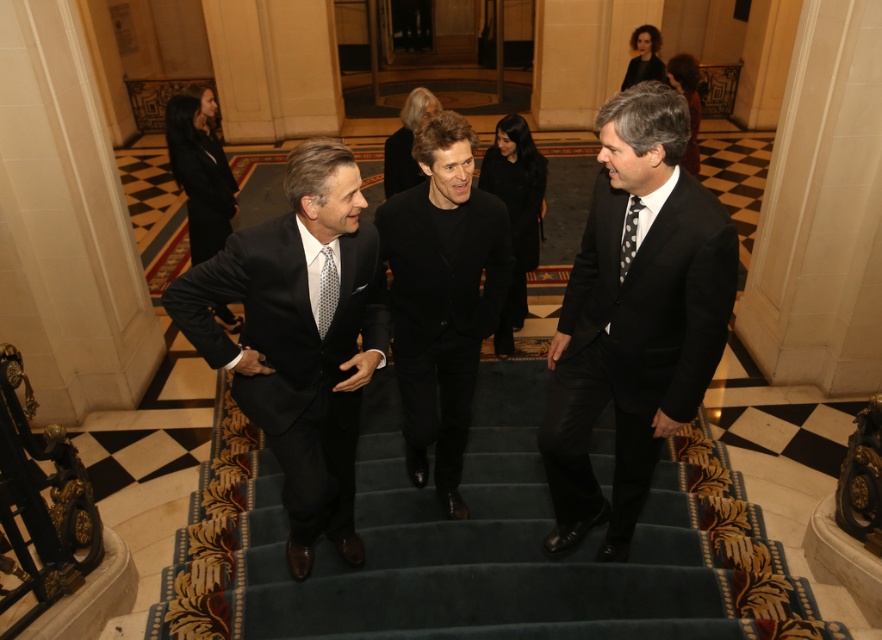
Question: Which of the following is the farthest from the observer?

Choices:
 (A) gray dotted tie at center
 (B) black satin suit at center
 (C) black velvet suit at center

Answer: (A)

Question: Which object is closer to the camera taking this photo?

Choices:
 (A) black dotted tie at center
 (B) black satin suit at center
 (C) black wool suit at center
 (D) gray dotted tie at center

Answer: (B)

Question: Can you confirm if black wool suit at center is positioned to the left of gray dotted tie at center?

Choices:
 (A) yes
 (B) no

Answer: (B)

Question: Which point appears farthest from the camera in this image?

Choices:
 (A) (572, 474)
 (B) (329, 321)

Answer: (A)

Question: Is black wool suit at center thinner than gray dotted tie at center?

Choices:
 (A) yes
 (B) no

Answer: (B)

Question: Can you confirm if black satin suit at center is positioned below gray dotted tie at center?

Choices:
 (A) yes
 (B) no

Answer: (A)